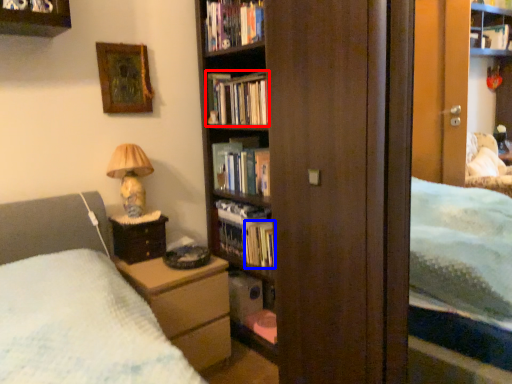
Question: Which object is closer to the camera taking this photo, book (highlighted by a red box) or book (highlighted by a blue box)?

Choices:
 (A) book
 (B) book

Answer: (B)